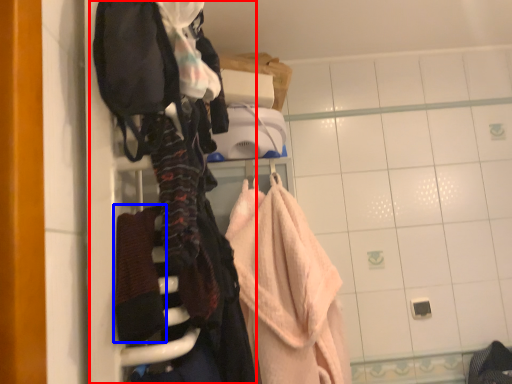
Question: Which of the following is the farthest to the observer, closet (highlighted by a red box) or bath towel (highlighted by a blue box)?

Choices:
 (A) closet
 (B) bath towel

Answer: (B)